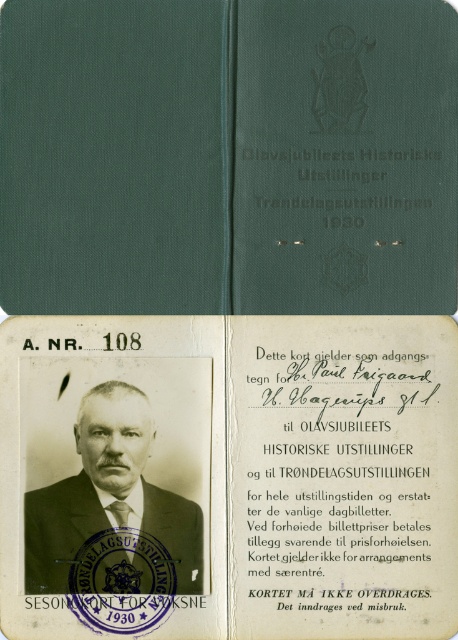
You are examining the vintage document from the Olavsjubileets Historiske Udstilling. You notice two points marked on the document. Which of these points, point (161, 486) or point (104, 298), is positioned closer to the viewer?

Point (161, 486) is closer to the viewer than point (104, 298).

You are a tailor examining a vintage outfit displayed on a mannequin. The display includes a green fabric journal at center and a matte black suit at center. Which item takes up more horizontal space on the display?

The green fabric journal at center might be wider than matte black suit at center, so it likely occupies more horizontal space.

You are holding the vintage document from the Olavsjubileets Historiske Udstilling. There is a point marked at coordinates (196, 86) on the document. If you want to place a small sticker exactly 1 meter away from this point towards the viewer, where would you place it?

The point at coordinates (196, 86) is 1.12 meters from the viewer. To place a sticker 1 meter away from this point towards the viewer, you would position it 0.12 meters closer to the viewer along the line extending from the original point.